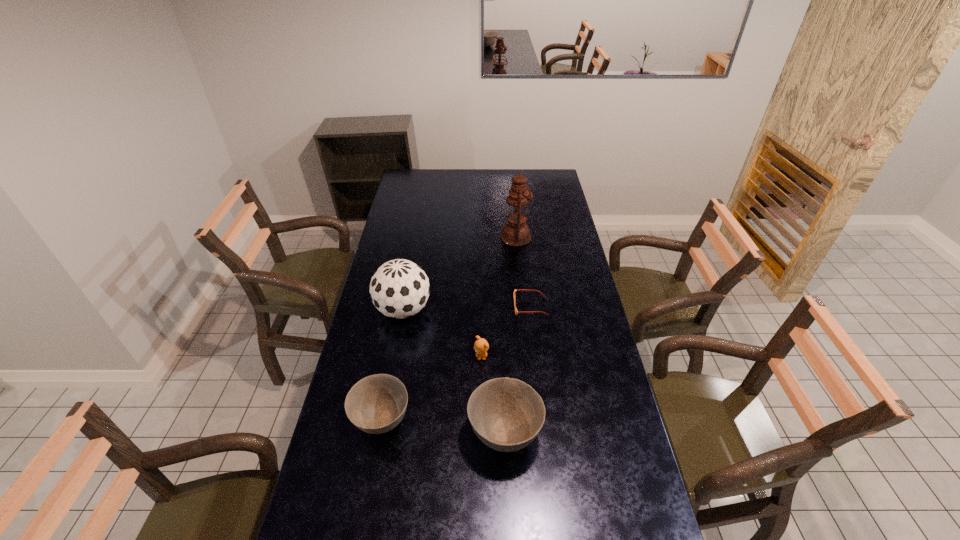
Find the location of a particular element. The height and width of the screenshot is (540, 960). free location located 0.400m on the back of the shorter bowl is located at coordinates (402, 308).

Identify the location of vacant space situated on the left of the right bowl. The width and height of the screenshot is (960, 540). (389, 433).

Where is `vacant area situated 0.280m on the front of the farthest object`? This screenshot has width=960, height=540. vacant area situated 0.280m on the front of the farthest object is located at coordinates [521, 290].

Locate an element on the screen. free point located 0.190m on the front-facing side of the spectacles is located at coordinates (466, 307).

Locate an element on the screen. The image size is (960, 540). vacant area situated 0.110m on the front-facing side of the spectacles is located at coordinates (486, 307).

Identify the location of vacant space located 0.310m on the front-facing side of the spectacles. Image resolution: width=960 pixels, height=540 pixels. (436, 307).

Image resolution: width=960 pixels, height=540 pixels. Identify the location of vacant space located on the back of the second tallest object. (412, 262).

This screenshot has height=540, width=960. What are the coordinates of `vacant region located on the face of the teddy bear` in the screenshot? It's located at (482, 441).

Locate an element on the screen. The height and width of the screenshot is (540, 960). bowl located in the left edge section of the desktop is located at coordinates (376, 404).

Where is `soccer ball that is at the left edge`? The height and width of the screenshot is (540, 960). soccer ball that is at the left edge is located at coordinates (399, 288).